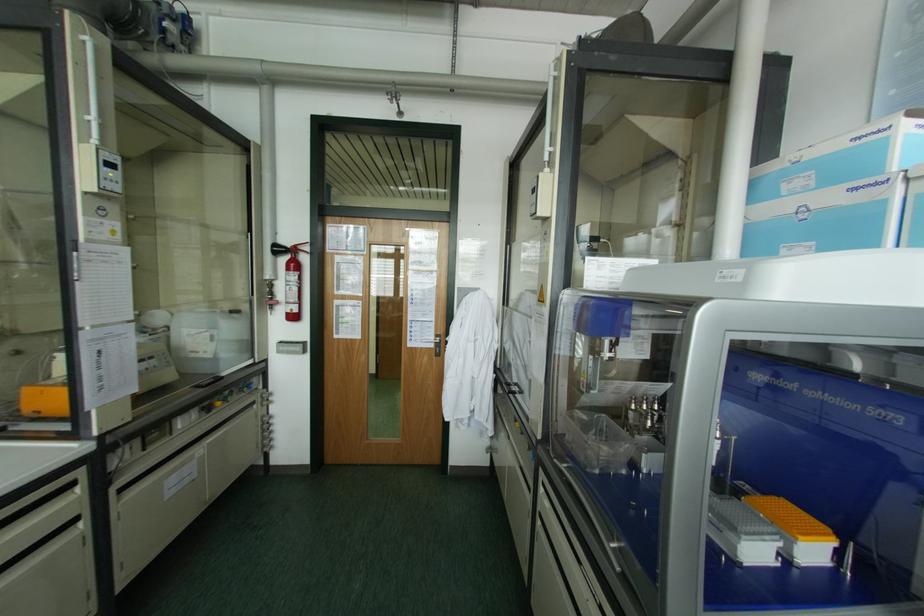
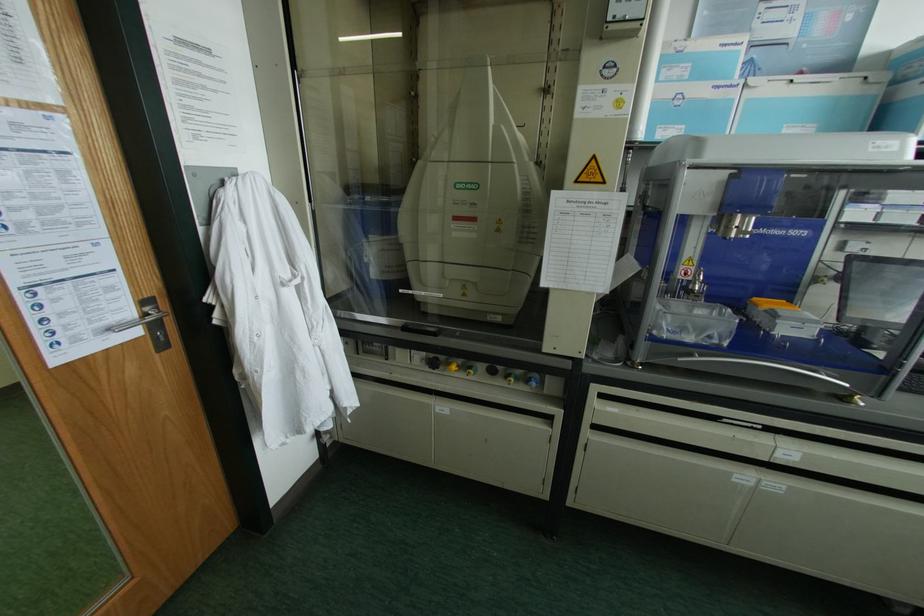
In the second image, find the point that corresponds to (435,334) in the first image.

(142, 302)